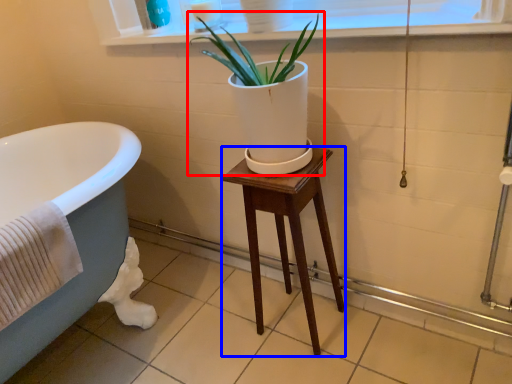
Question: Among these objects, which one is farthest to the camera, houseplant (highlighted by a red box) or stool (highlighted by a blue box)?

Choices:
 (A) houseplant
 (B) stool

Answer: (B)